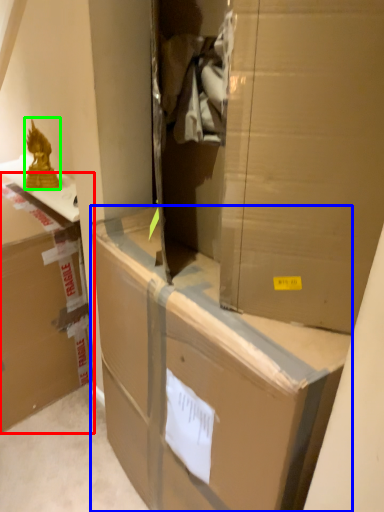
Question: Which object is positioned farthest from box (highlighted by a red box)? Select from box (highlighted by a blue box) and wrap (highlighted by a green box).

Choices:
 (A) box
 (B) wrap

Answer: (A)